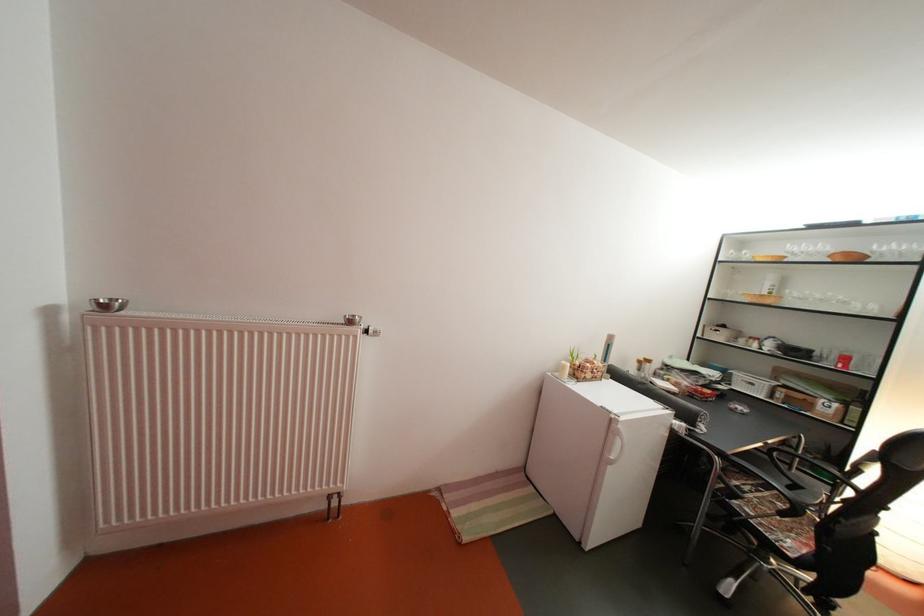
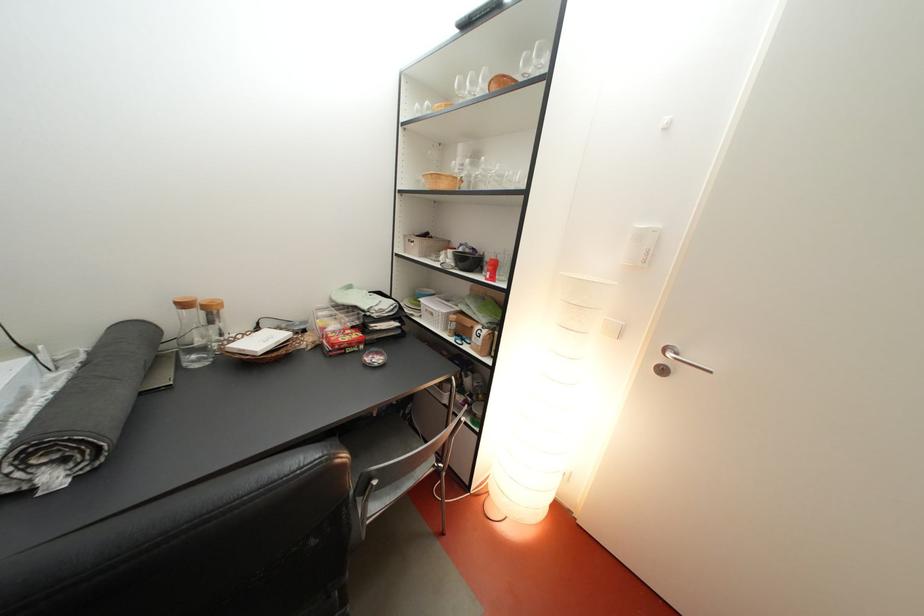
Question: Which direction would the cameraman need to move to produce the second image? Reply with the corresponding letter.

Choices:
 (A) Left
 (B) Right
 (C) Forward
 (D) Backward

Answer: (B)